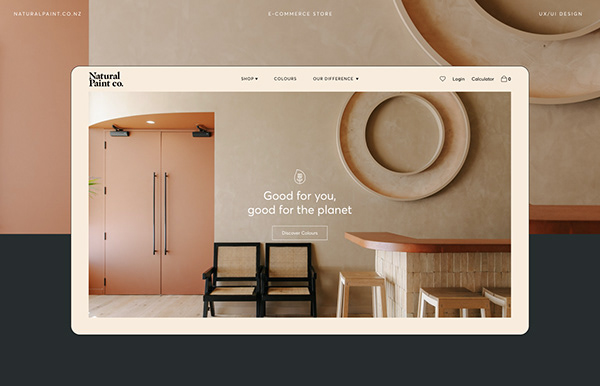
This screenshot has height=386, width=600. Find the location of `counter top`. counter top is located at coordinates (383, 240).